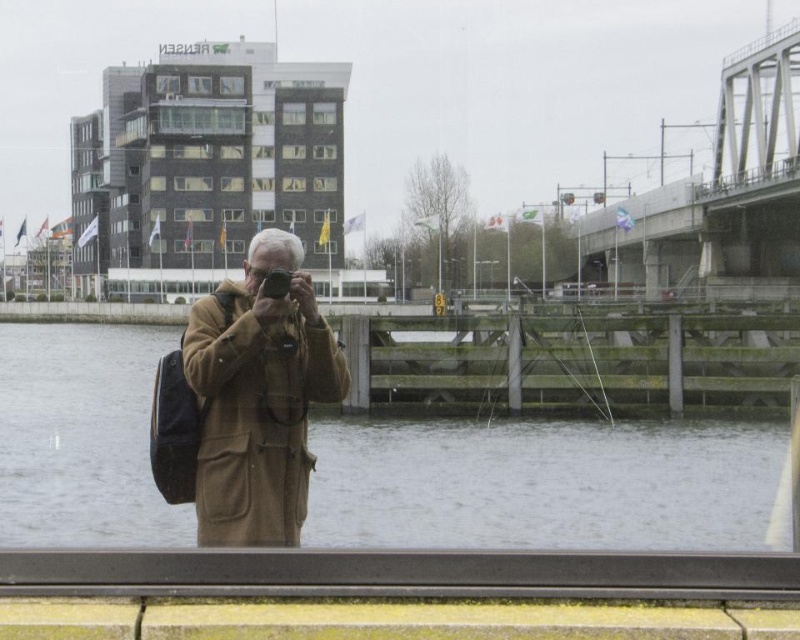
Is brown water at center thinner than brown wool coat at center?

No.

Who is positioned more to the left, brown water at center or brown wool coat at center?

Positioned to the left is brown water at center.

Locate an element on the screen. The height and width of the screenshot is (640, 800). brown water at center is located at coordinates (542, 483).

Identify the location of brown water at center. (542, 483).

Locate an element on the screen. brown wool coat at center is located at coordinates (258, 397).

Between point (260, 401) and point (264, 276), which one is positioned behind?

The point (260, 401) is behind.

You are a GUI agent. You are given a task and a screenshot of the screen. Output one action in this format:
    pyautogui.click(x=<x>, y=<y>)
    Task: Click on the brown wool coat at center
    This screenshot has height=640, width=800.
    Given the screenshot: What is the action you would take?
    pyautogui.click(x=258, y=397)

In order to click on brown water at center in this screenshot , I will do `click(542, 483)`.

Does brown water at center appear on the left side of matte black camera at center?

Correct, you'll find brown water at center to the left of matte black camera at center.

Find the location of `brown water at center`. brown water at center is located at coordinates (542, 483).